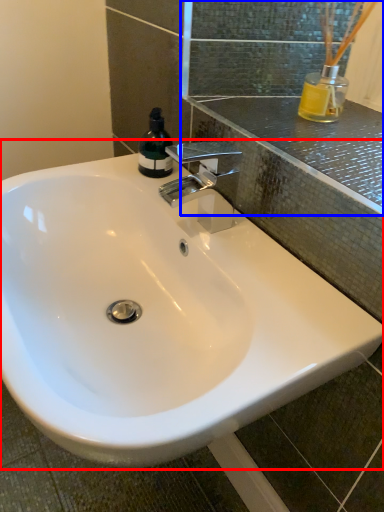
Question: Among these objects, which one is farthest to the camera, sink (highlighted by a red box) or mirror (highlighted by a blue box)?

Choices:
 (A) sink
 (B) mirror

Answer: (B)